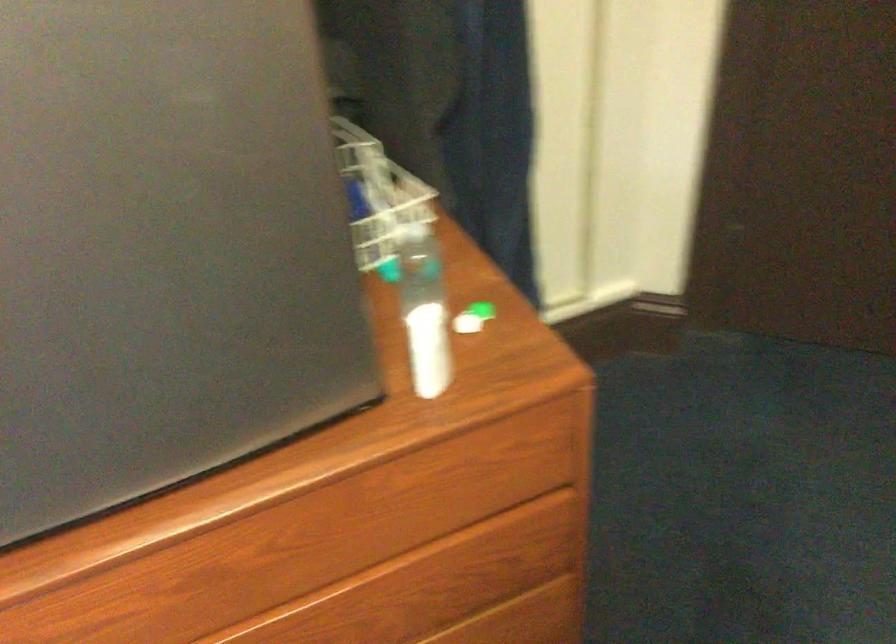
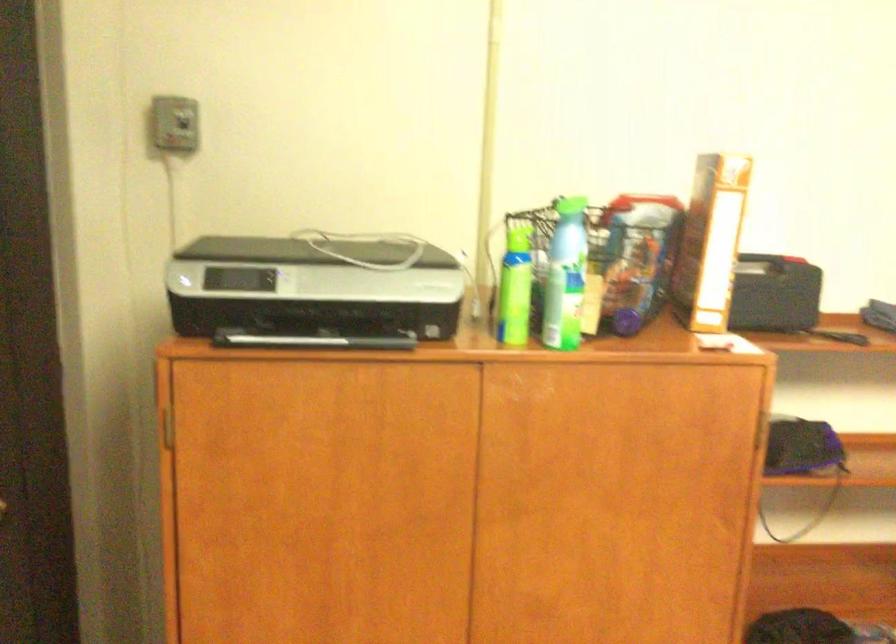
Question: The camera is either moving clockwise (left) or counter-clockwise (right) around the object. The first image is from the beginning of the video and the second image is from the end. Is the camera moving left or right when shooting the video?

Choices:
 (A) Left
 (B) Right

Answer: (A)